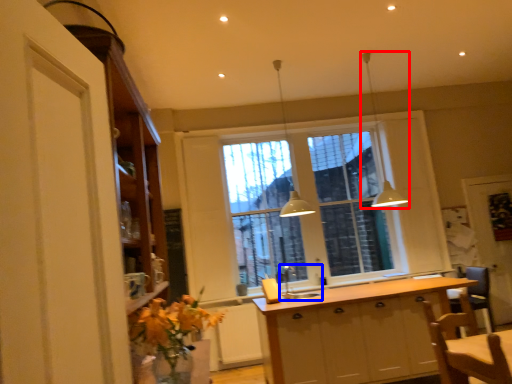
Question: Which of the following is the farthest to the observer, light fixture (highlighted by a red box) or sink (highlighted by a blue box)?

Choices:
 (A) light fixture
 (B) sink

Answer: (A)